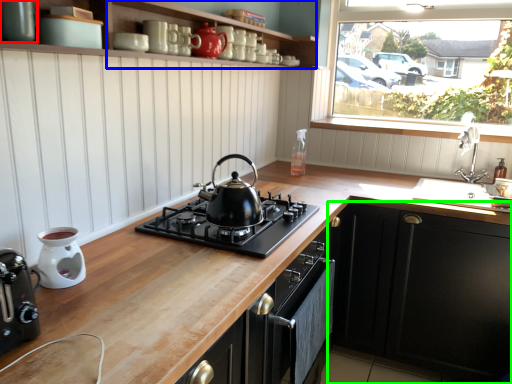
Question: Estimate the real-world distances between objects in this image. Which object is farther from kitchen appliance (highlighted by a red box), shelf (highlighted by a blue box) or cabinetry (highlighted by a green box)?

Choices:
 (A) shelf
 (B) cabinetry

Answer: (B)